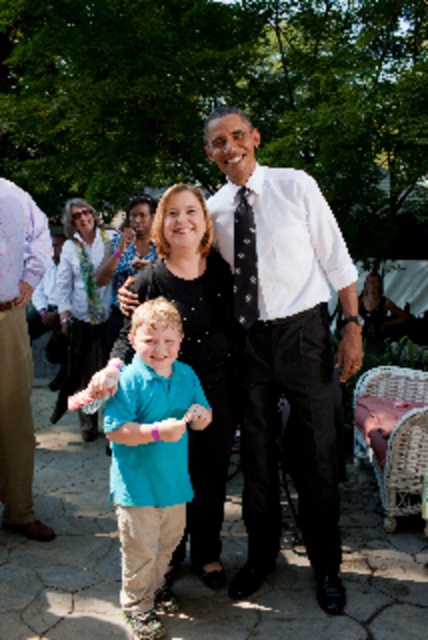
You are organizing a photo shoot and need to ensure that the teal cotton shirt at center and the black dotted tie at center are visible in the frame. Based on their sizes, which object would require more horizontal space in the camera frame?

The teal cotton shirt at center might require more horizontal space in the camera frame than the black dotted tie at center because it is wider.